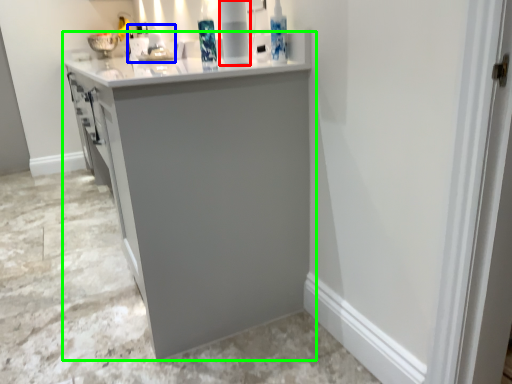
Question: Which object is the farthest from appliance (highlighted by a red box)? Choose among these: sink (highlighted by a blue box) or cabinetry (highlighted by a green box).

Choices:
 (A) sink
 (B) cabinetry

Answer: (A)